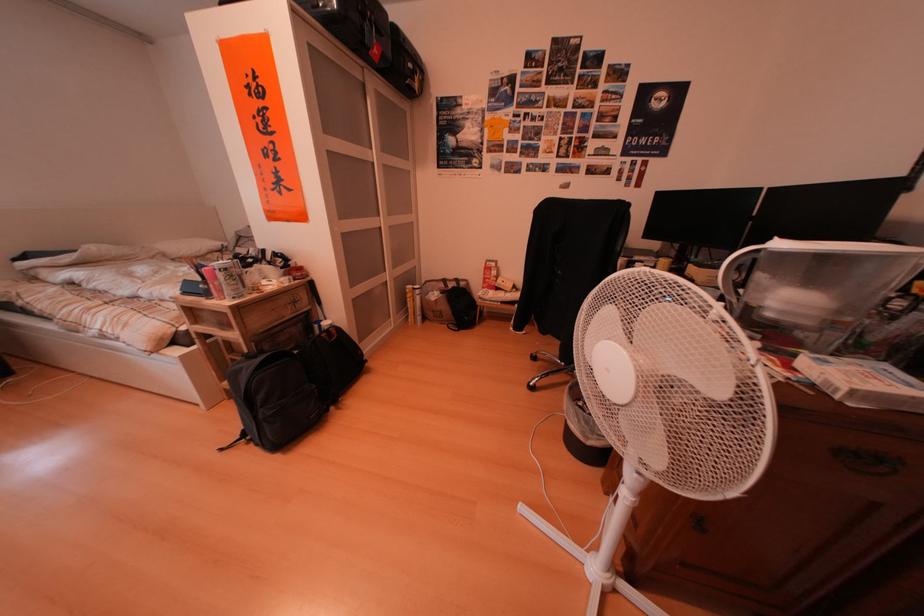
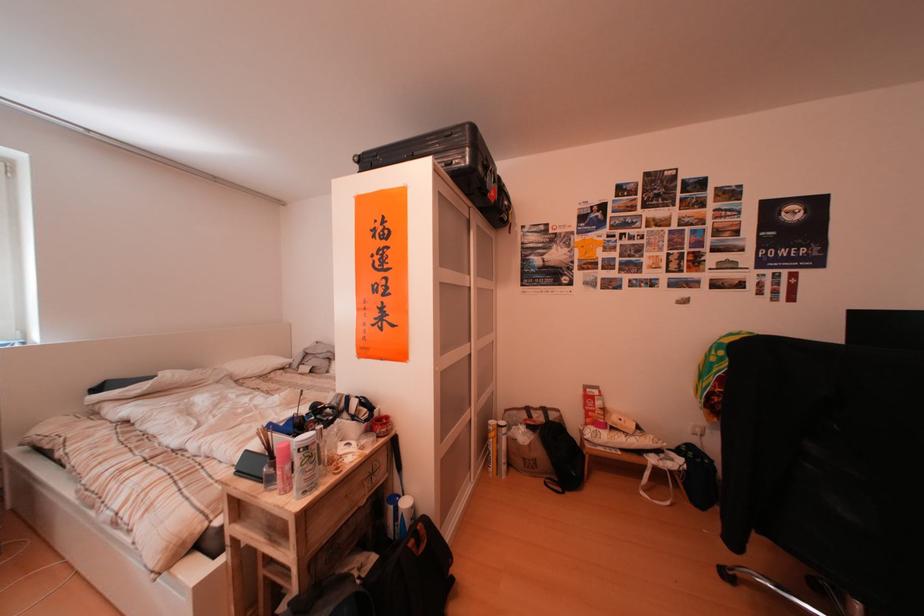
The point at [495,294] is marked in the first image. Where is the corresponding point in the second image?

(599, 430)